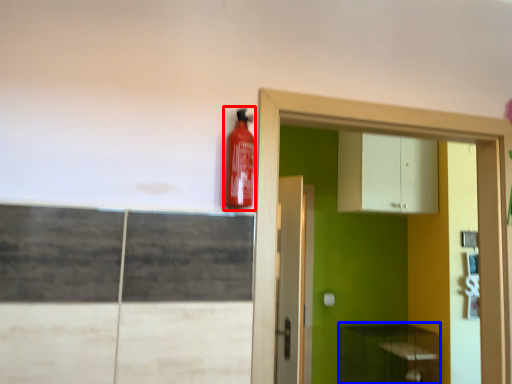
Question: Which of the following is the farthest to the observer, extinguisher (highlighted by a red box) or cabinetry (highlighted by a blue box)?

Choices:
 (A) extinguisher
 (B) cabinetry

Answer: (B)